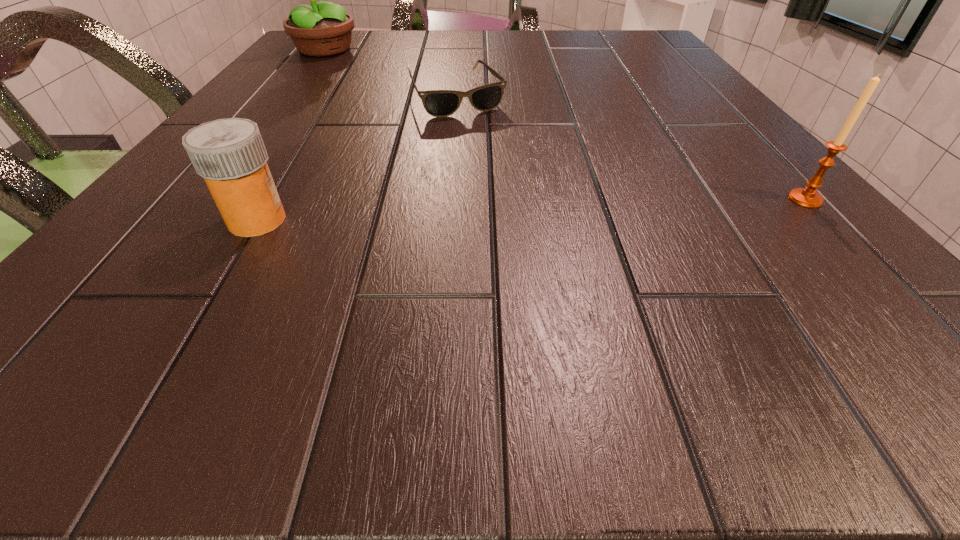
The height and width of the screenshot is (540, 960). I want to click on vacant region located on the lenses of the sunglasses, so click(x=489, y=142).

Where is `vacant space situated 0.100m on the lenses of the sunglasses`? Image resolution: width=960 pixels, height=540 pixels. vacant space situated 0.100m on the lenses of the sunglasses is located at coordinates (489, 142).

Locate an element on the screen. vacant position located 0.330m on the face of the sunflower is located at coordinates 417,105.

You are a GUI agent. You are given a task and a screenshot of the screen. Output one action in this format:
    pyautogui.click(x=<x>, y=<y>)
    Task: Click on the vacant space situated 0.330m on the face of the sunflower
    This screenshot has height=540, width=960.
    Given the screenshot: What is the action you would take?
    pyautogui.click(x=417, y=105)

Image resolution: width=960 pixels, height=540 pixels. What are the coordinates of `free space located 0.100m on the face of the sunflower` in the screenshot? It's located at (360, 71).

Identify the location of object located at the far edge. This screenshot has height=540, width=960. (323, 29).

The image size is (960, 540). What are the coordinates of `object that is at the near edge` in the screenshot? It's located at (230, 155).

This screenshot has height=540, width=960. Identify the location of medicine that is at the left edge. pyautogui.click(x=230, y=155).

Image resolution: width=960 pixels, height=540 pixels. What are the coordinates of `sunflower at the left edge` in the screenshot? It's located at (323, 29).

The width and height of the screenshot is (960, 540). Find the location of `object at the right edge`. object at the right edge is located at coordinates (807, 197).